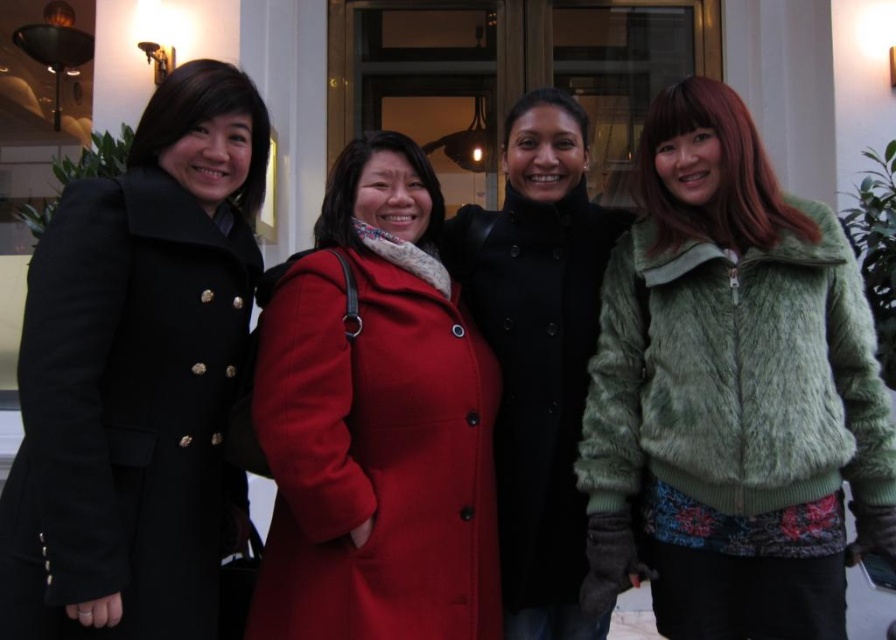
You are a photographer trying to capture a group photo of the green furry jacket at right and the velvet black coat at center. Since you want to include both subjects in the frame, where should you position them relative to each other to ensure they are both visible?

To ensure both the green furry jacket at right and the velvet black coat at center are visible in the frame, position the green furry jacket at right to the right side of the velvet black coat at center.

You are a photographer standing 10 feet away from the building entrance. You want to take a group photo of the matte black coat at left and the matte woolen coat at center. Considering the distance between them, can you frame both subjects comfortably within a standard camera frame that has a 50mm focal length?

The distance between the matte black coat at left and the matte woolen coat at center is 26.75 inches. At a 50mm focal length and a distance of 10 feet, the camera frame can comfortably include both subjects since the separation between them is within the frame width.